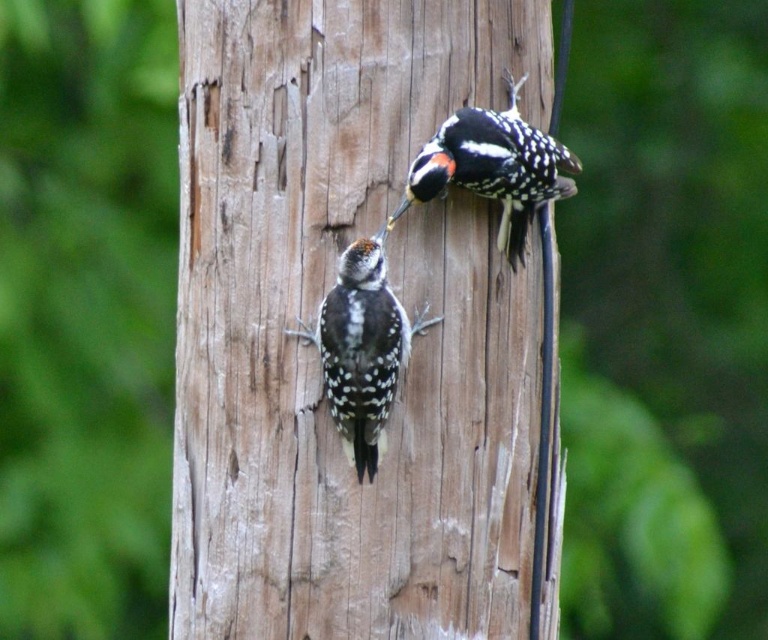
Question: Can you confirm if speckled feathered woodpecker at center is smaller than speckled brown woodpecker at upper center?

Choices:
 (A) no
 (B) yes

Answer: (B)

Question: Is speckled feathered woodpecker at center further to the viewer compared to speckled brown woodpecker at upper center?

Choices:
 (A) no
 (B) yes

Answer: (A)

Question: Which point is farther to the camera?

Choices:
 (A) (339, 422)
 (B) (497, 118)

Answer: (B)

Question: Where is speckled feathered woodpecker at center located in relation to speckled brown woodpecker at upper center in the image?

Choices:
 (A) right
 (B) left

Answer: (B)

Question: Which of the following is the farthest from the observer?

Choices:
 (A) speckled feathered woodpecker at center
 (B) speckled brown woodpecker at upper center

Answer: (B)